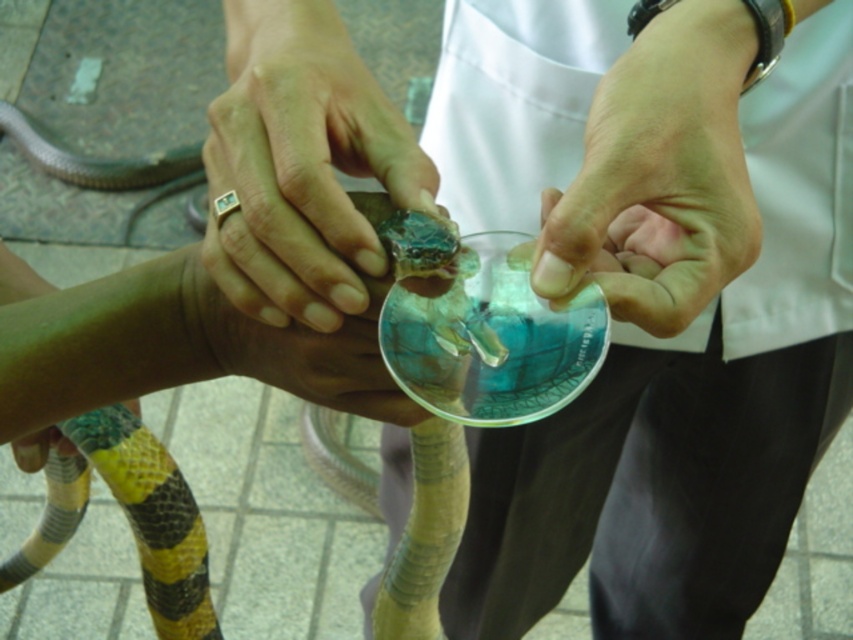
What do you see at coordinates (660, 173) in the screenshot? I see `smooth skin hand at center` at bounding box center [660, 173].

Does smooth skin hand at center appear on the left side of green smooth skin at lower left?

No, smooth skin hand at center is not to the left of green smooth skin at lower left.

Where is `smooth skin hand at center`? Image resolution: width=853 pixels, height=640 pixels. smooth skin hand at center is located at coordinates pyautogui.click(x=660, y=173).

You are a GUI agent. You are given a task and a screenshot of the screen. Output one action in this format:
    pyautogui.click(x=<x>, y=<y>)
    Task: Click on the smooth skin hand at center
    The image size is (853, 640).
    Given the screenshot: What is the action you would take?
    pyautogui.click(x=660, y=173)

Does smooth skin hand at center appear over yellow/golden textured snake at center?

Correct, smooth skin hand at center is located above yellow/golden textured snake at center.

The height and width of the screenshot is (640, 853). What do you see at coordinates (660, 173) in the screenshot? I see `smooth skin hand at center` at bounding box center [660, 173].

Identify the location of smooth skin hand at center. (660, 173).

Which is more to the left, gold ring at center or yellow/golden textured snake at center?

Positioned to the left is gold ring at center.

Which is above, gold ring at center or yellow/golden textured snake at center?

gold ring at center

Which is behind, point (430, 186) or point (355, 349)?

The point (430, 186) is more distant.

Locate an element on the screen. gold ring at center is located at coordinates (300, 164).